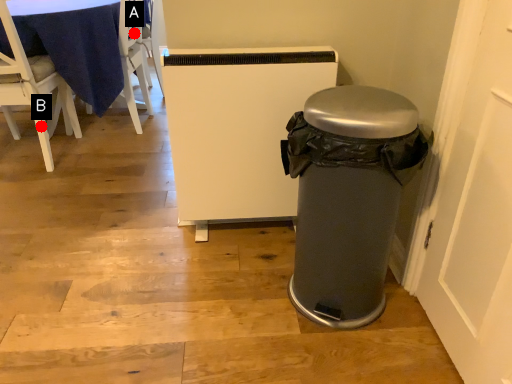
Question: Two points are circled on the image, labeled by A and B beside each circle. Which of the following is the farthest from the observer?

Choices:
 (A) A is further
 (B) B is further

Answer: (A)